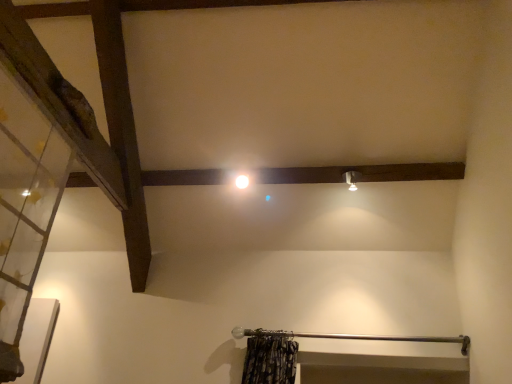
Question: Does metallic curtain rod at lower center lie behind matte silver light fixture at upper right?

Choices:
 (A) yes
 (B) no

Answer: (B)

Question: Is matte silver light fixture at upper right at the back of metallic curtain rod at lower center?

Choices:
 (A) no
 (B) yes

Answer: (A)

Question: From a real-world perspective, is metallic curtain rod at lower center positioned over matte silver light fixture at upper right based on gravity?

Choices:
 (A) yes
 (B) no

Answer: (B)

Question: Is metallic curtain rod at lower center at the left side of matte silver light fixture at upper right?

Choices:
 (A) no
 (B) yes

Answer: (B)

Question: Can you confirm if metallic curtain rod at lower center is thinner than matte silver light fixture at upper right?

Choices:
 (A) yes
 (B) no

Answer: (B)

Question: From the image's perspective, is matte silver light fixture at upper right above or below transparent glass door at left?

Choices:
 (A) below
 (B) above

Answer: (B)

Question: From a real-world perspective, is matte silver light fixture at upper right physically located above or below transparent glass door at left?

Choices:
 (A) above
 (B) below

Answer: (A)

Question: Choose the correct answer: Is matte silver light fixture at upper right inside transparent glass door at left or outside it?

Choices:
 (A) outside
 (B) inside

Answer: (A)

Question: Based on their sizes in the image, would you say matte silver light fixture at upper right is bigger or smaller than transparent glass door at left?

Choices:
 (A) big
 (B) small

Answer: (B)

Question: Considering the positions of white glossy light at center and transparent glass door at left in the image, is white glossy light at center bigger or smaller than transparent glass door at left?

Choices:
 (A) big
 (B) small

Answer: (B)

Question: Is white glossy light at center spatially inside transparent glass door at left, or outside of it?

Choices:
 (A) inside
 (B) outside

Answer: (B)

Question: From their relative heights in the image, would you say white glossy light at center is taller or shorter than transparent glass door at left?

Choices:
 (A) short
 (B) tall

Answer: (A)

Question: In terms of width, does white glossy light at center look wider or thinner when compared to transparent glass door at left?

Choices:
 (A) wide
 (B) thin

Answer: (A)

Question: Which is correct: transparent glass door at left is inside matte silver light fixture at upper right, or outside of it?

Choices:
 (A) outside
 (B) inside

Answer: (A)

Question: In the image, is transparent glass door at left on the left side or the right side of matte silver light fixture at upper right?

Choices:
 (A) left
 (B) right

Answer: (A)